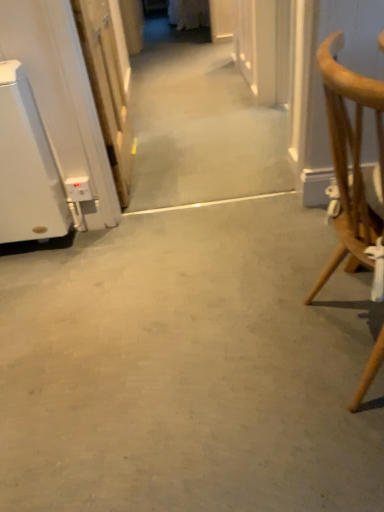
Question: Should I look upward or downward to see light brown wooden chair at right?

Choices:
 (A) down
 (B) up

Answer: (B)

Question: Is gray concrete floor at center in contact with light brown wooden chair at right?

Choices:
 (A) yes
 (B) no

Answer: (B)

Question: Does gray concrete floor at center have a larger size compared to light brown wooden chair at right?

Choices:
 (A) no
 (B) yes

Answer: (A)

Question: Is the depth of gray concrete floor at center less than that of light brown wooden chair at right?

Choices:
 (A) yes
 (B) no

Answer: (B)

Question: From the image's perspective, is gray concrete floor at center below light brown wooden chair at right?

Choices:
 (A) no
 (B) yes

Answer: (B)

Question: Is gray concrete floor at center further to the viewer compared to light brown wooden chair at right?

Choices:
 (A) yes
 (B) no

Answer: (A)

Question: Is gray concrete floor at center to the left of light brown wooden chair at right from the viewer's perspective?

Choices:
 (A) yes
 (B) no

Answer: (A)

Question: Is gray concrete floor at center not within white glossy door at left?

Choices:
 (A) yes
 (B) no

Answer: (A)

Question: Is gray concrete floor at center to the right of white glossy door at left from the viewer's perspective?

Choices:
 (A) yes
 (B) no

Answer: (A)

Question: Is gray concrete floor at center surrounding white glossy door at left?

Choices:
 (A) no
 (B) yes

Answer: (A)

Question: Does gray concrete floor at center have a greater width compared to white glossy door at left?

Choices:
 (A) no
 (B) yes

Answer: (B)

Question: Can you confirm if gray concrete floor at center is taller than white glossy door at left?

Choices:
 (A) yes
 (B) no

Answer: (B)

Question: Considering the relative sizes of gray concrete floor at center and white glossy door at left in the image provided, is gray concrete floor at center thinner than white glossy door at left?

Choices:
 (A) yes
 (B) no

Answer: (B)

Question: From the image's perspective, is white glossy door at left beneath gray concrete floor at center?

Choices:
 (A) yes
 (B) no

Answer: (B)